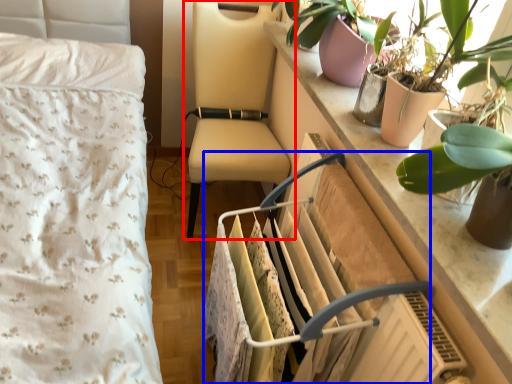
Question: Which object is closer to the camera taking this photo, chair (highlighted by a red box) or closet (highlighted by a blue box)?

Choices:
 (A) chair
 (B) closet

Answer: (B)